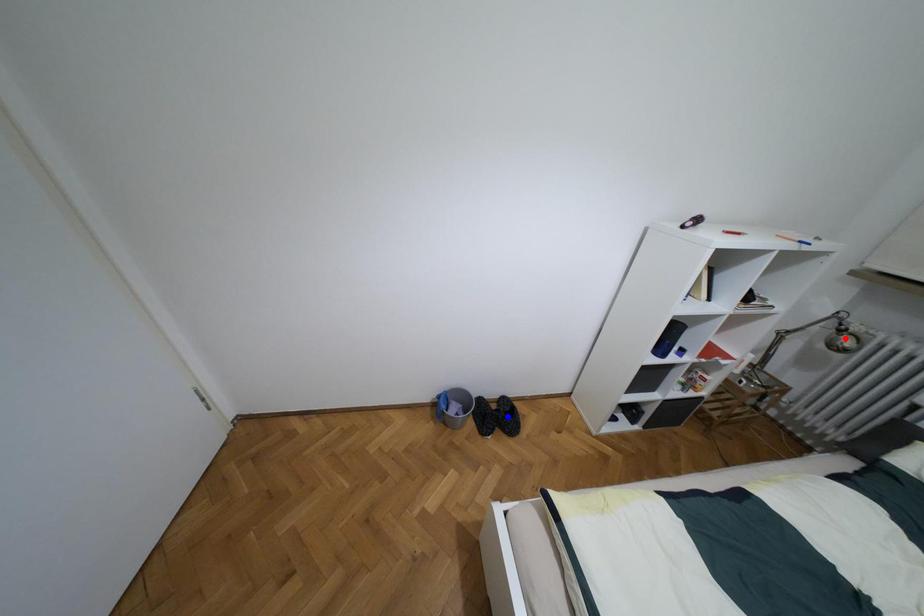
Question: In the image, two points are highlighted. Which point is nearer to the camera? Reply with the corresponding letter.

Choices:
 (A) blue point
 (B) red point

Answer: (B)